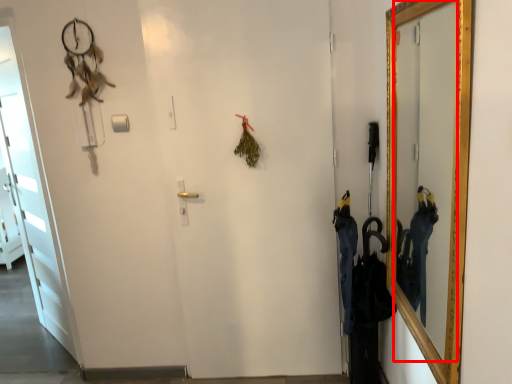
Question: From the image's perspective, what is the correct spatial positioning of mirror (annotated by the red box) in reference to door?

Choices:
 (A) above
 (B) below

Answer: (A)